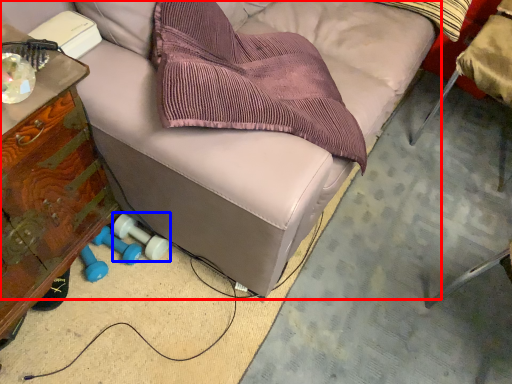
Question: Which object is closer to the camera taking this photo, furniture (highlighted by a red box) or dumbbell (highlighted by a blue box)?

Choices:
 (A) furniture
 (B) dumbbell

Answer: (A)